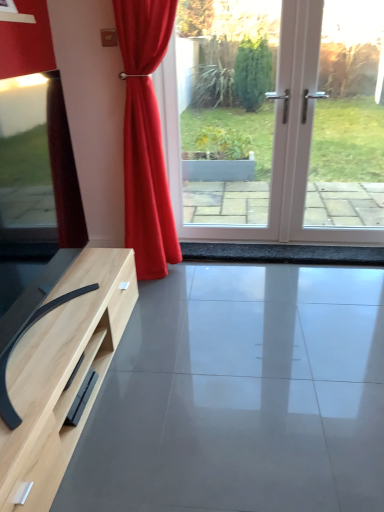
Question: Can you confirm if matte wood tv stand at lower left is shorter than satin red curtain at center?

Choices:
 (A) yes
 (B) no

Answer: (A)

Question: Is matte wood tv stand at lower left to the left of satin red curtain at center from the viewer's perspective?

Choices:
 (A) no
 (B) yes

Answer: (A)

Question: Is matte wood tv stand at lower left smaller than satin red curtain at center?

Choices:
 (A) no
 (B) yes

Answer: (B)

Question: From the image's perspective, is matte wood tv stand at lower left above satin red curtain at center?

Choices:
 (A) yes
 (B) no

Answer: (B)

Question: Is matte wood tv stand at lower left positioned beyond the bounds of satin red curtain at center?

Choices:
 (A) yes
 (B) no

Answer: (A)

Question: Is point [135, 220] closer or farther from the camera than point [304, 416]?

Choices:
 (A) farther
 (B) closer

Answer: (A)

Question: Based on their positions, is satin red curtain at center located to the left or right of matte wood tv stand at lower left?

Choices:
 (A) left
 (B) right

Answer: (A)

Question: Is satin red curtain at center wider or thinner than matte wood tv stand at lower left?

Choices:
 (A) thin
 (B) wide

Answer: (A)

Question: From the image's perspective, is satin red curtain at center above or below matte wood tv stand at lower left?

Choices:
 (A) above
 (B) below

Answer: (A)

Question: Looking at their shapes, would you say white glossy screen door at center is wider or thinner than satin red curtain at center?

Choices:
 (A) thin
 (B) wide

Answer: (A)

Question: From a real-world perspective, is white glossy screen door at center above or below satin red curtain at center?

Choices:
 (A) above
 (B) below

Answer: (A)

Question: Choose the correct answer: Is white glossy screen door at center inside satin red curtain at center or outside it?

Choices:
 (A) outside
 (B) inside

Answer: (A)

Question: Based on their positions, is white glossy screen door at center located to the left or right of satin red curtain at center?

Choices:
 (A) right
 (B) left

Answer: (A)

Question: Considering their positions, is matte wood tv stand at lower left located in front of or behind satin red curtain at center?

Choices:
 (A) behind
 (B) front

Answer: (B)

Question: Based on their sizes in the image, would you say matte wood tv stand at lower left is bigger or smaller than satin red curtain at center?

Choices:
 (A) big
 (B) small

Answer: (B)